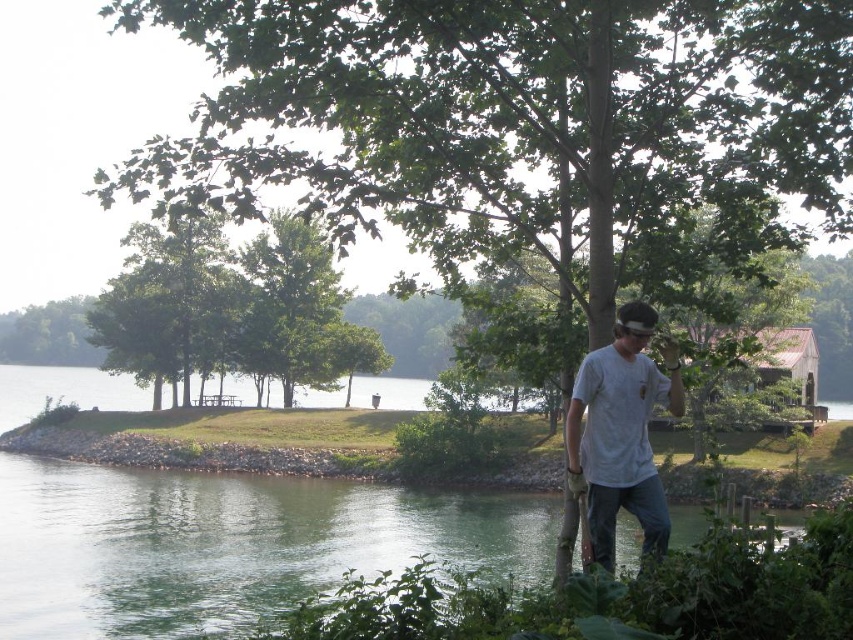
Question: Among these objects, which one is nearest to the camera?

Choices:
 (A) gray cotton t-shirt at center
 (B) clear water at lower left

Answer: (A)

Question: Which of the following is the closest to the observer?

Choices:
 (A) tap(590, 401)
 (B) tap(483, 515)

Answer: (A)

Question: Can you confirm if clear water at lower left is positioned above gray cotton t-shirt at center?

Choices:
 (A) yes
 (B) no

Answer: (B)

Question: Does clear water at lower left come in front of gray cotton t-shirt at center?

Choices:
 (A) no
 (B) yes

Answer: (A)

Question: Can you confirm if clear water at lower left is wider than gray cotton t-shirt at center?

Choices:
 (A) no
 (B) yes

Answer: (B)

Question: Which of the following is the farthest from the observer?

Choices:
 (A) gray cotton t-shirt at center
 (B) clear water at lower left

Answer: (B)